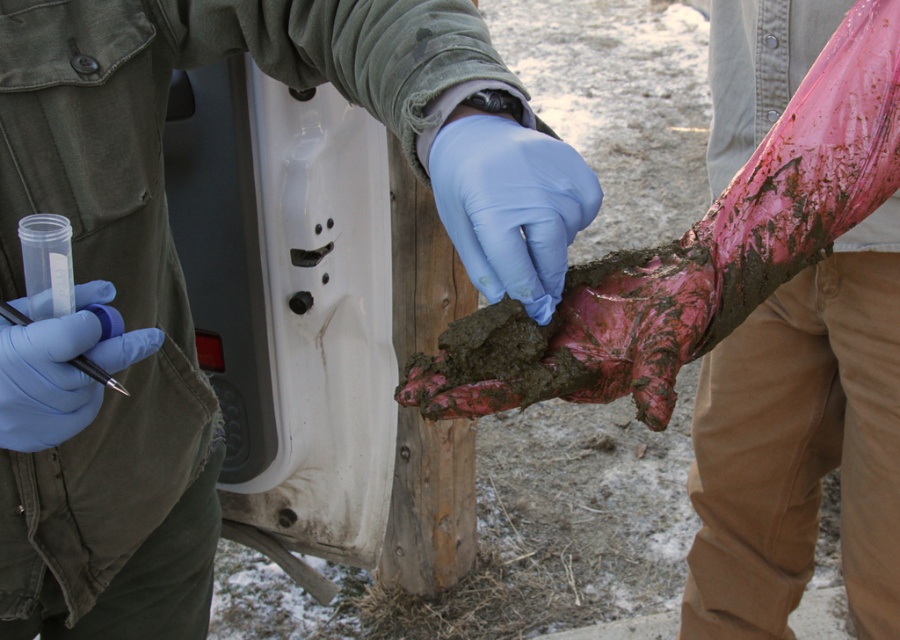
Is muddy plastic bag at center taller than blue latex glove at center?

Yes, muddy plastic bag at center is taller than blue latex glove at center.

Measure the distance between muddy plastic bag at center and blue latex glove at center.

muddy plastic bag at center and blue latex glove at center are 1.03 meters apart from each other.

Where is `muddy plastic bag at center`? The width and height of the screenshot is (900, 640). muddy plastic bag at center is located at coordinates (801, 444).

Is point (144, 417) closer to camera compared to point (78, 307)?

No, it is behind (78, 307).

Between muddy rubber glove at center and blue rubber glove at lower left, which one appears on the left side from the viewer's perspective?

From the viewer's perspective, muddy rubber glove at center appears more on the left side.

Where is `muddy rubber glove at center`? muddy rubber glove at center is located at coordinates (181, 273).

Which is more to the left, muddy rubber glove at center or muddy plastic bag at center?

From the viewer's perspective, muddy rubber glove at center appears more on the left side.

Is muddy rubber glove at center behind muddy plastic bag at center?

No, muddy rubber glove at center is closer to the viewer.

Does point (52, 339) come behind point (880, 358)?

No, (52, 339) is closer to viewer.

Where is `muddy rubber glove at center`? Image resolution: width=900 pixels, height=640 pixels. muddy rubber glove at center is located at coordinates (181, 273).